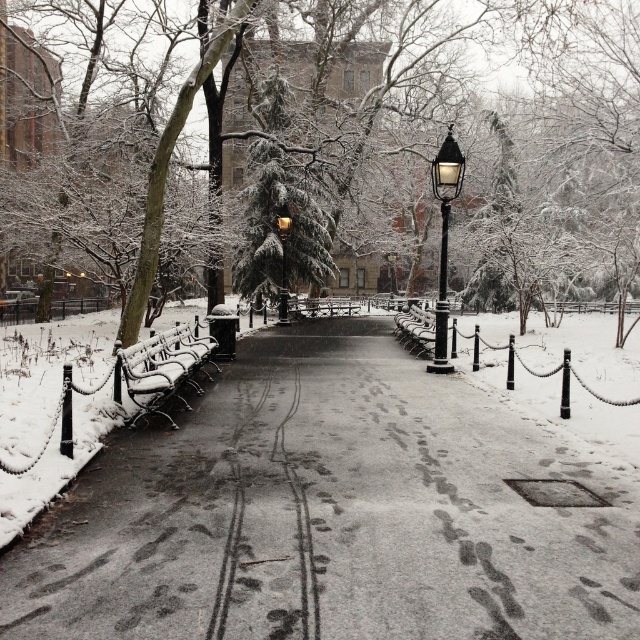
Can you confirm if snowy concrete path at center is shorter than gold polished metal streetlight at center?

Yes.

Which is behind, point (419, 392) or point (285, 225)?

The point (285, 225) is more distant.

This screenshot has width=640, height=640. What are the coordinates of `snowy concrete path at center` in the screenshot? It's located at (330, 513).

Is snow-covered evergreen tree at center closer to the viewer compared to black glass lamp post at center?

No, it is not.

Which is above, snow-covered evergreen tree at center or black glass lamp post at center?

snow-covered evergreen tree at center is higher up.

Between point (566, 124) and point (461, 156), which one is positioned behind?

The point (566, 124) is behind.

This screenshot has height=640, width=640. What are the coordinates of `snow-covered evergreen tree at center` in the screenshot? It's located at (589, 74).

Does snow-covered evergreen tree at center lie behind snow-covered wood bench at left?

Yes, snow-covered evergreen tree at center is further from the viewer.

Is snow-covered evergreen tree at center thinner than snow-covered wood bench at left?

Incorrect, snow-covered evergreen tree at center's width is not less than snow-covered wood bench at left's.

Is point (572, 134) closer to camera compared to point (176, 337)?

No, (572, 134) is behind (176, 337).

This screenshot has width=640, height=640. Find the location of `snow-covered evergreen tree at center`. snow-covered evergreen tree at center is located at coordinates coord(589,74).